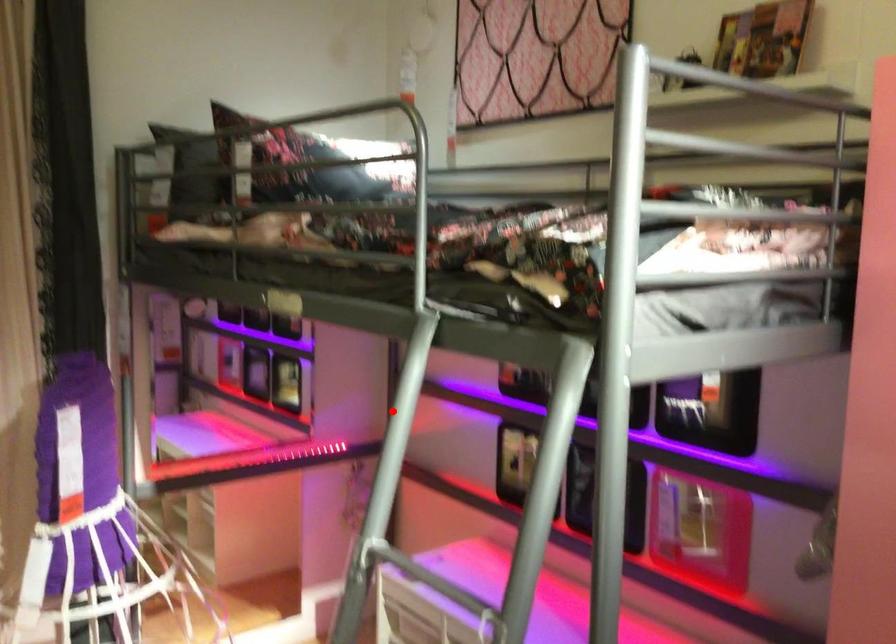
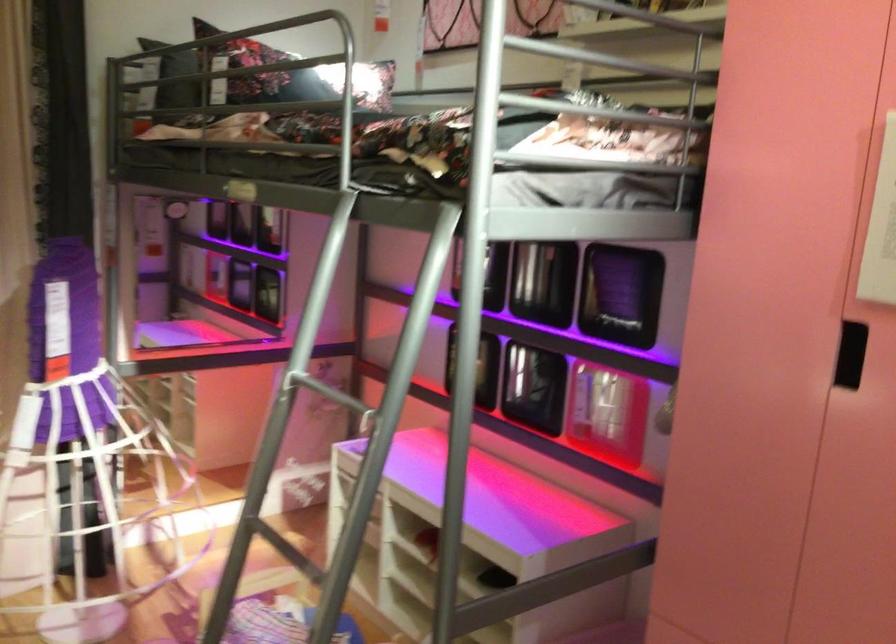
Question: I am providing you with two images of the same scene from different viewpoints. In image1, a red point is highlighted. Considering the same 3D point in image2, which of the following is correct?

Choices:
 (A) It is closer
 (B) It is farther

Answer: (B)